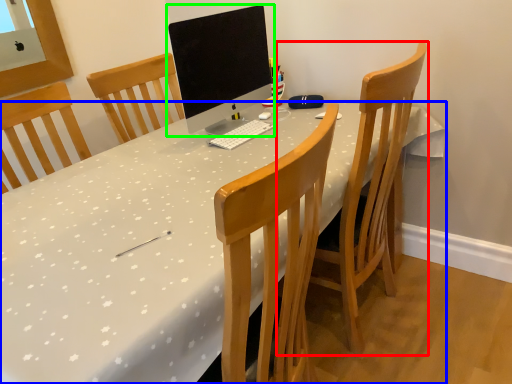
Question: Which object is the closest to the chair (highlighted by a red box)? Choose among these: desk (highlighted by a blue box) or computer monitor (highlighted by a green box).

Choices:
 (A) desk
 (B) computer monitor

Answer: (A)